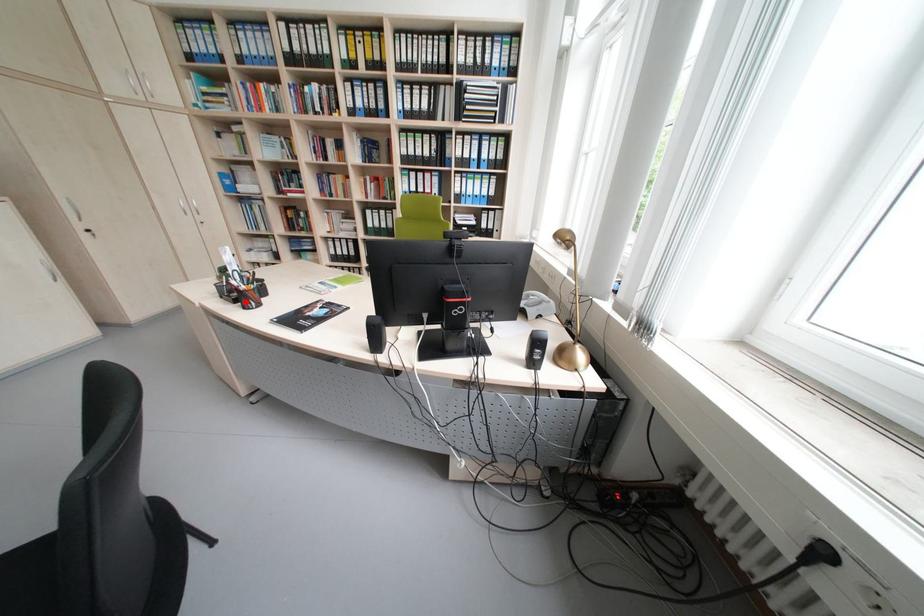
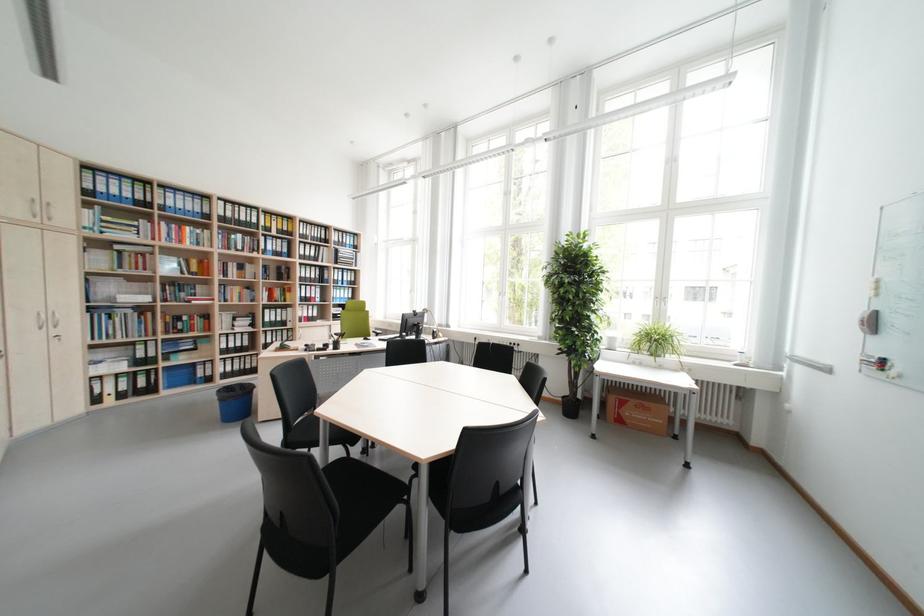
Question: I am providing you with two images of the same scene from different viewpoints. A red point is marked on the first image. Can you still see the location of the red point in image 2?

Choices:
 (A) Yes
 (B) No

Answer: (B)